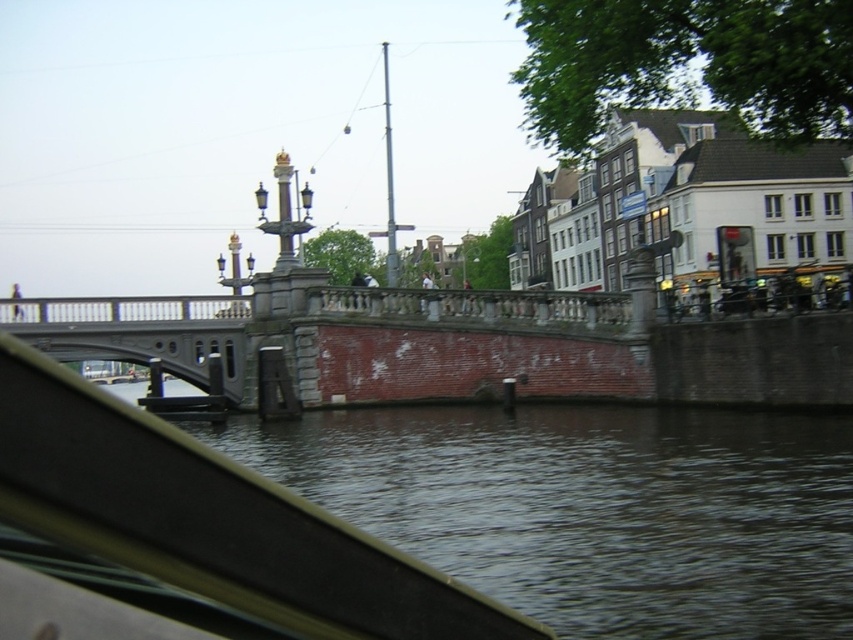
Question: Can you confirm if dark water at lower center is positioned below gray concrete bridge at center?

Choices:
 (A) no
 (B) yes

Answer: (B)

Question: Is dark water at lower center to the right of gray concrete bridge at center from the viewer's perspective?

Choices:
 (A) no
 (B) yes

Answer: (B)

Question: Observing the image, what is the correct spatial positioning of dark water at lower center in reference to gray concrete bridge at center?

Choices:
 (A) right
 (B) left

Answer: (A)

Question: Which point is farther to the camera?

Choices:
 (A) (440, 554)
 (B) (231, 380)

Answer: (B)

Question: Which point is closer to the camera?

Choices:
 (A) (546, 604)
 (B) (183, 355)

Answer: (A)